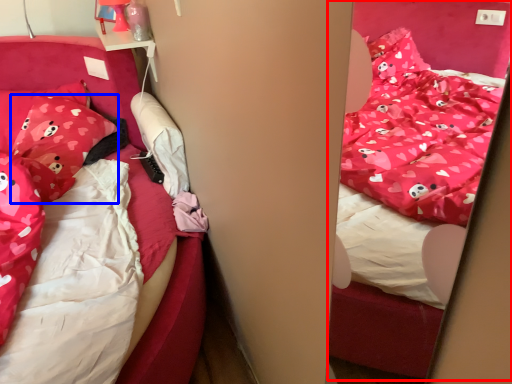
Question: Which point is closer to the camera, bed (highlighted by a red box) or pillow (highlighted by a blue box)?

Choices:
 (A) bed
 (B) pillow

Answer: (A)